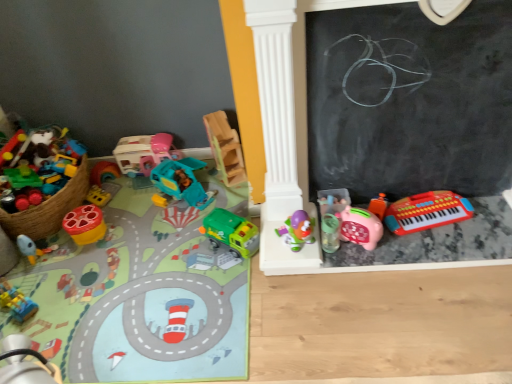
Where is `free space between teal plastic car at center, marked as the 7th toy in a right-to-left arrangement, and shiny plastic toy at left, arranged as the 3th toy when viewed from the left`? free space between teal plastic car at center, marked as the 7th toy in a right-to-left arrangement, and shiny plastic toy at left, arranged as the 3th toy when viewed from the left is located at coordinates (133, 214).